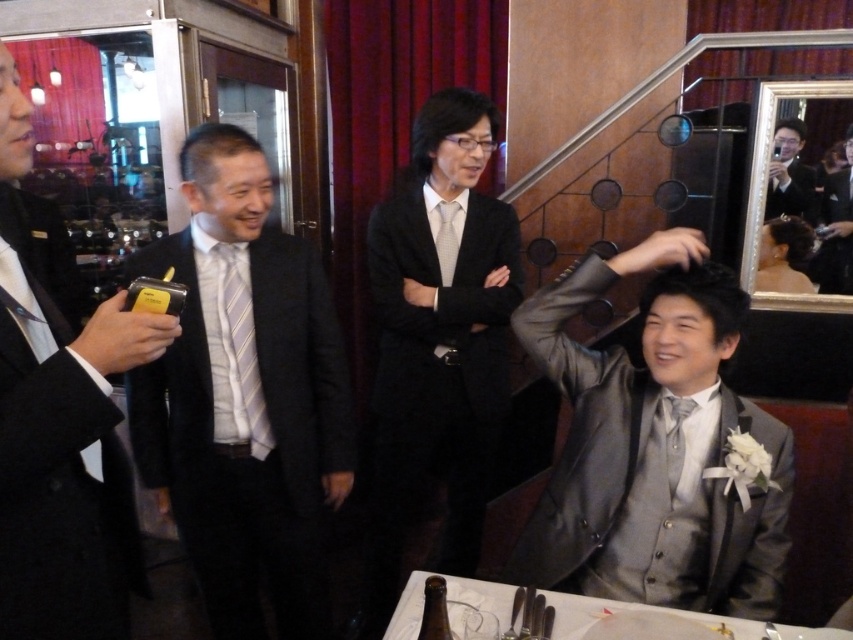
You are a photographer at the event and need to capture a photo of both the black glossy suit at center and the striped silk tie at center. Since the camera can only focus on one subject at a time, which one should you focus on to ensure it appears larger in the photo?

The black glossy suit at center is much taller than the striped silk tie at center, so focusing on it will make it appear larger in the photo.

Looking at this image, what is located at the coordinates point (631, 609) in the image?

The coordinates point (631, 609) indicate the location of the white paper at lower center.